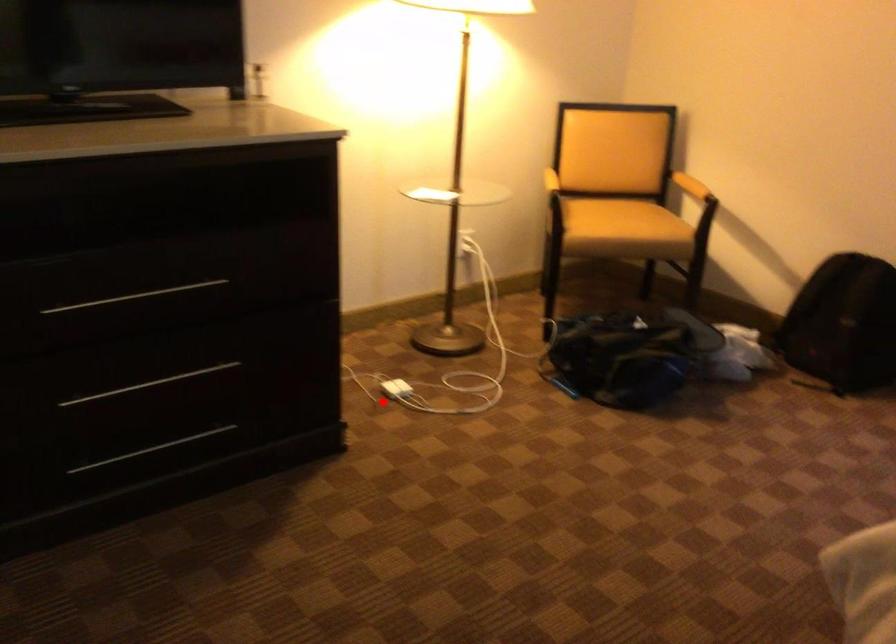
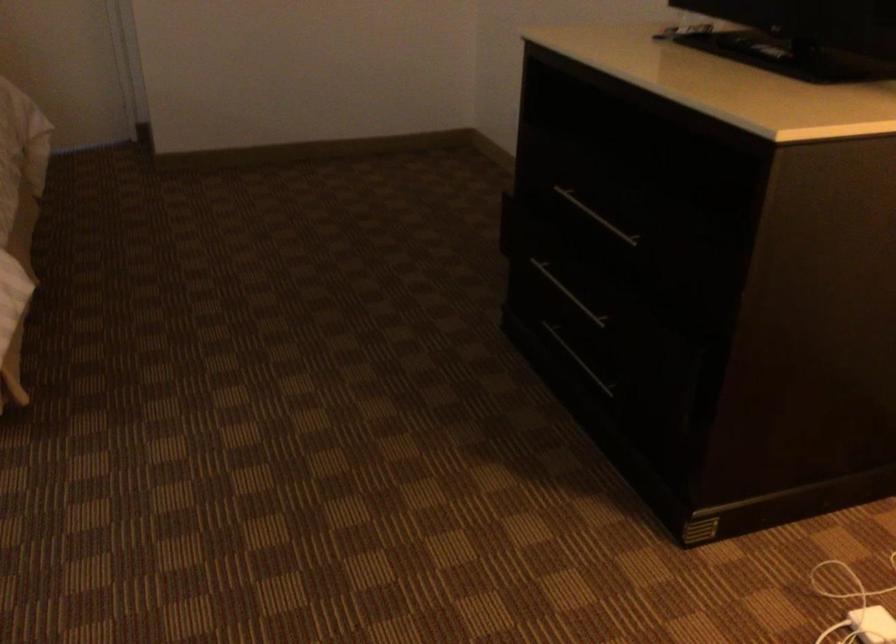
Question: A red point is marked in image1. In image2, is the corresponding 3D point closer to the camera or farther? Reply with the corresponding letter.

Choices:
 (A) The corresponding 3D point is closer.
 (B) The corresponding 3D point is farther.

Answer: (A)